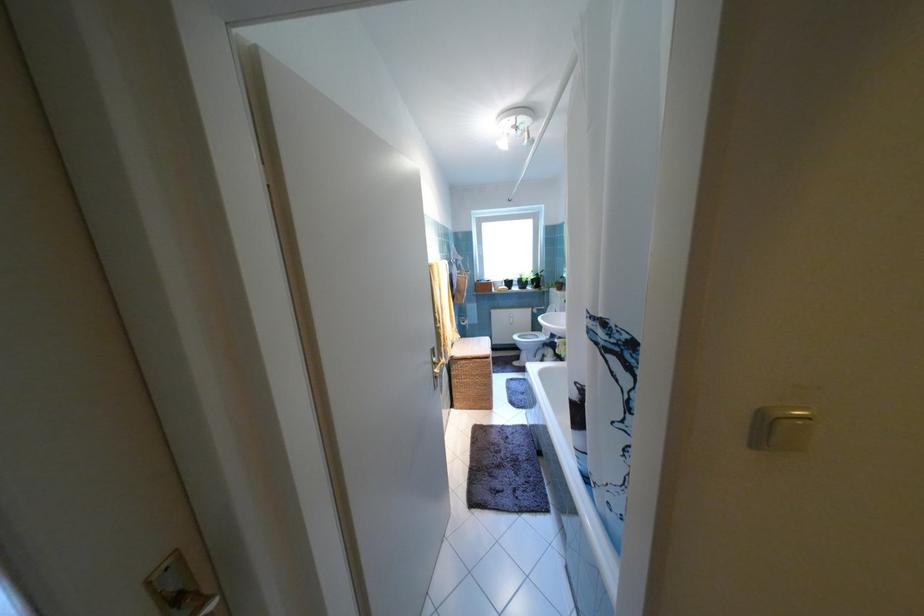
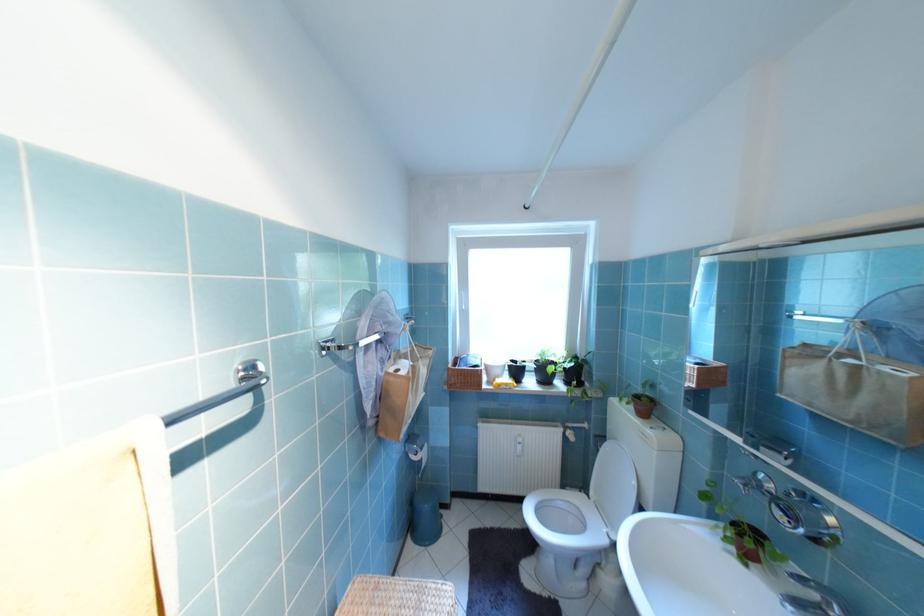
Question: In a continuous first-person perspective shot, in which direction is the camera moving?

Choices:
 (A) Left
 (B) Right
 (C) Forward
 (D) Backward

Answer: (C)